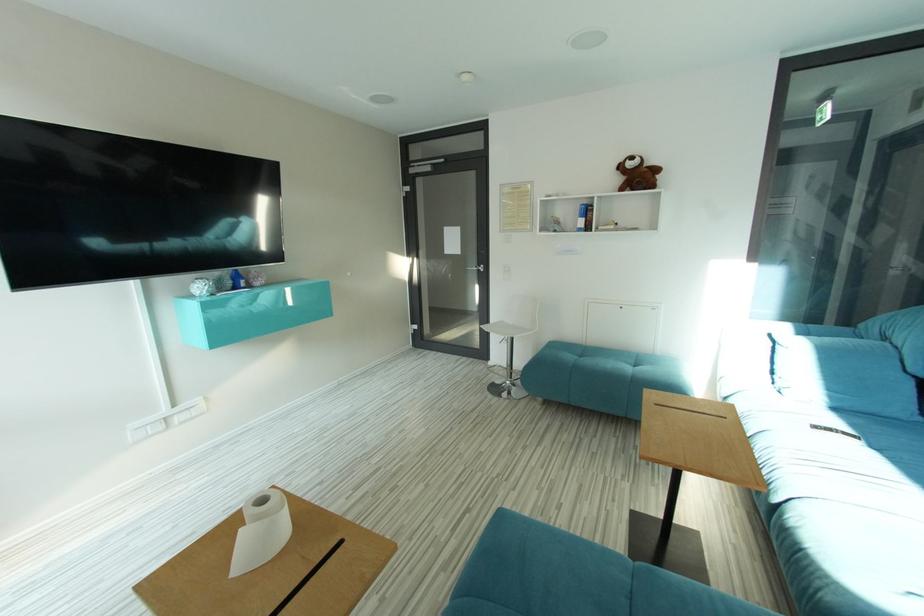
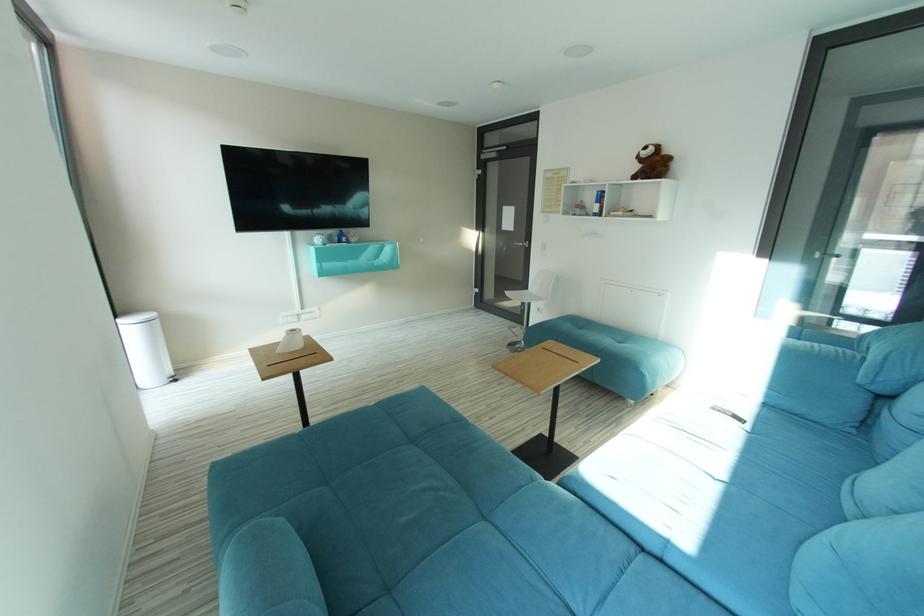
Which direction would the cameraman need to move to produce the second image?

The cameraman walked toward right, backward.